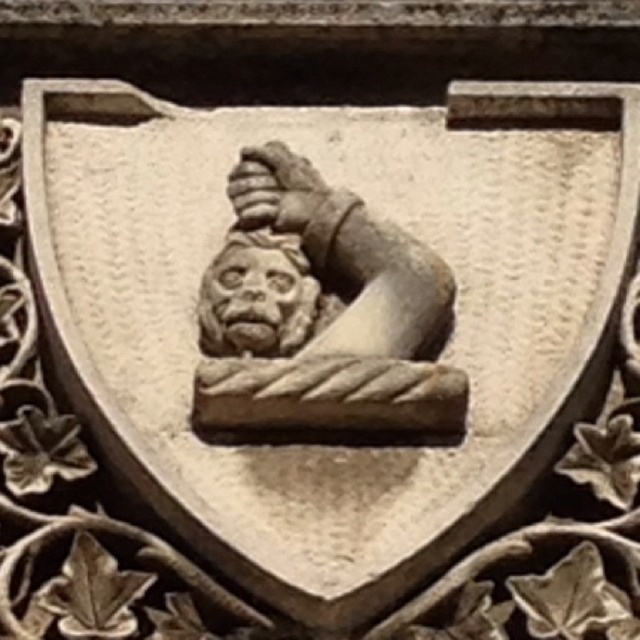
Question: Which object appears farthest from the camera in this image?

Choices:
 (A) carved stone face at center
 (B) stone textured gargoyle at center

Answer: (B)

Question: Which point is farther to the camera?

Choices:
 (A) (209, 336)
 (B) (273, 186)

Answer: (B)

Question: Observing the image, what is the correct spatial positioning of stone textured gargoyle at center in reference to carved stone face at center?

Choices:
 (A) left
 (B) right

Answer: (B)

Question: Considering the relative positions of stone textured gargoyle at center and carved stone face at center in the image provided, where is stone textured gargoyle at center located with respect to carved stone face at center?

Choices:
 (A) left
 (B) right

Answer: (B)

Question: Where is stone textured gargoyle at center located in relation to carved stone face at center in the image?

Choices:
 (A) right
 (B) left

Answer: (A)